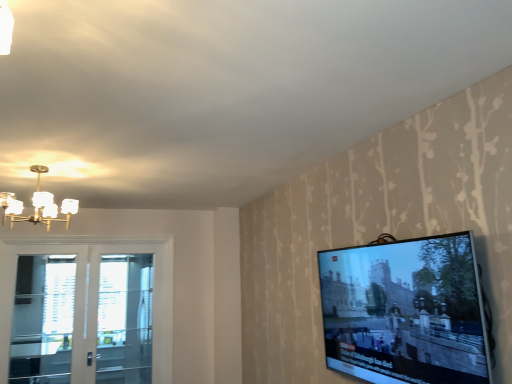
Question: Based on their positions, is white glass door at left located to the left or right of clear glass screen door at left, the 1th screen door from the left?

Choices:
 (A) right
 (B) left

Answer: (A)

Question: Considering the positions of white glass door at left and clear glass screen door at left, the 1th screen door from the left, in the image, is white glass door at left bigger or smaller than clear glass screen door at left, the 1th screen door from the left,?

Choices:
 (A) small
 (B) big

Answer: (B)

Question: Which object is the farthest from the matte glass chandelier at upper left?

Choices:
 (A) flat screen tv at right
 (B) white glass door at left
 (C) clear glass door at left, acting as the 2th screen door starting from the left
 (D) clear glass screen door at left, the 1th screen door from the left

Answer: (A)

Question: Based on their relative distances, which object is nearer to the clear glass door at left, acting as the 2th screen door starting from the left?

Choices:
 (A) flat screen tv at right
 (B) clear glass screen door at left, the 1th screen door from the left
 (C) matte glass chandelier at upper left
 (D) white glass door at left

Answer: (D)